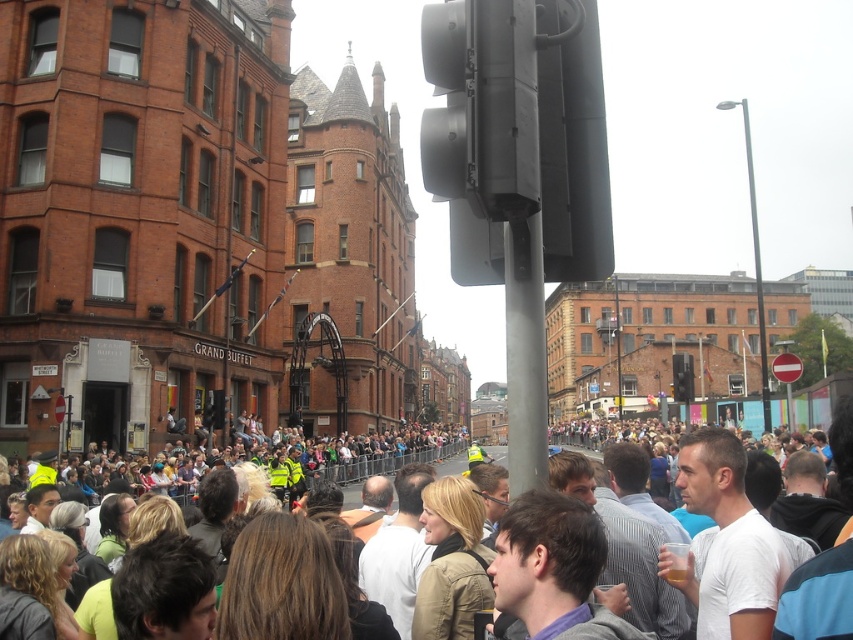
Is point (679, 384) positioned after point (207, 413)?

That is True.

Does black plastic traffic light at center come behind metallic traffic light at center?

Yes, black plastic traffic light at center is behind metallic traffic light at center.

Locate an element on the screen. This screenshot has height=640, width=853. black plastic traffic light at center is located at coordinates (682, 378).

Find the location of `black plastic traffic light at center`. black plastic traffic light at center is located at coordinates (682, 378).

Does black matte traffic light at upper center have a larger size compared to white casual clothing at center?

Actually, black matte traffic light at upper center might be smaller than white casual clothing at center.

Identify the location of black matte traffic light at upper center. This screenshot has height=640, width=853. click(x=518, y=132).

Between point (554, 86) and point (763, 456), which one is positioned in front?

Positioned in front is point (554, 86).

I want to click on black matte traffic light at upper center, so click(x=518, y=132).

How far apart are metallic gray pole at center and metallic traffic light at center?

metallic gray pole at center is 26.55 meters away from metallic traffic light at center.

Which is in front, point (509, 452) or point (216, 404)?

Point (509, 452) is more forward.

This screenshot has width=853, height=640. In order to click on metallic gray pole at center in this screenshot , I will do `click(525, 353)`.